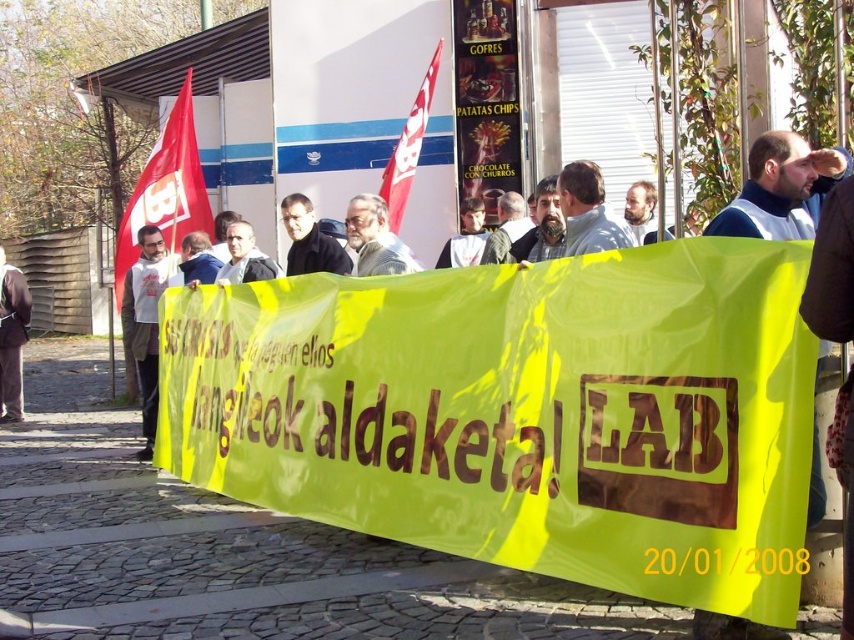
Is white fleece jacket at left positioned at the back of red fabric flag at upper center?

No, it is not.

Who is more forward, [156,268] or [431,70]?

Positioned in front is point [156,268].

Which is behind, point (147, 387) or point (420, 129)?

Point (420, 129)

The width and height of the screenshot is (854, 640). What are the coordinates of `white fleece jacket at left` in the screenshot? It's located at 145,323.

Is point (434, 60) farther from viewer compared to point (626, 195)?

Yes, point (434, 60) is farther from viewer.

Which of these two, red fabric flag at upper center or beige fabric jacket at center, stands taller?

With more height is red fabric flag at upper center.

Describe the element at coordinates (408, 147) in the screenshot. I see `red fabric flag at upper center` at that location.

You are a GUI agent. You are given a task and a screenshot of the screen. Output one action in this format:
    pyautogui.click(x=<x>, y=<y>)
    Task: Click on the red fabric flag at upper center
    The image size is (854, 640).
    Given the screenshot: What is the action you would take?
    pyautogui.click(x=408, y=147)

Is red fabric flag at left thinner than beige fabric jacket at center?

No.

Does red fabric flag at left have a larger size compared to beige fabric jacket at center?

Indeed, red fabric flag at left has a larger size compared to beige fabric jacket at center.

You are a GUI agent. You are given a task and a screenshot of the screen. Output one action in this format:
    pyautogui.click(x=<x>, y=<y>)
    Task: Click on the red fabric flag at left
    This screenshot has height=640, width=854.
    Given the screenshot: What is the action you would take?
    pyautogui.click(x=165, y=189)